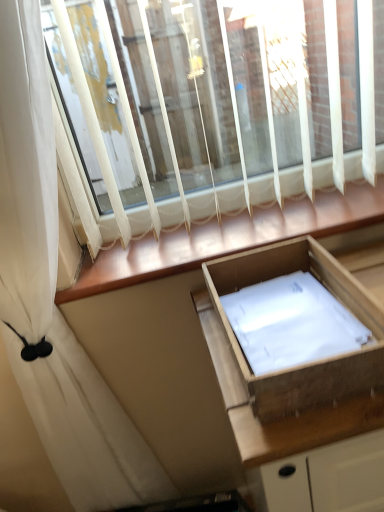
Question: Is white sheer curtain at upper left in contact with wooden at lower center?

Choices:
 (A) no
 (B) yes

Answer: (A)

Question: Can you confirm if white sheer curtain at upper left is positioned to the left of wooden at lower center?

Choices:
 (A) no
 (B) yes

Answer: (B)

Question: Is white sheer curtain at upper left thinner than wooden at lower center?

Choices:
 (A) yes
 (B) no

Answer: (A)

Question: Is wooden at lower center a part of white sheer curtain at upper left?

Choices:
 (A) yes
 (B) no

Answer: (B)

Question: Considering the relative sizes of white sheer curtain at upper left and wooden at lower center in the image provided, is white sheer curtain at upper left shorter than wooden at lower center?

Choices:
 (A) no
 (B) yes

Answer: (A)

Question: From the image's perspective, relative to wooden drawer at center, is white sheer curtain at upper left above or below?

Choices:
 (A) below
 (B) above

Answer: (B)

Question: Considering the positions of point (51, 221) and point (210, 292), is point (51, 221) closer or farther from the camera than point (210, 292)?

Choices:
 (A) farther
 (B) closer

Answer: (B)

Question: Is white sheer curtain at upper left in front of or behind wooden drawer at center in the image?

Choices:
 (A) behind
 (B) front

Answer: (B)

Question: From their relative heights in the image, would you say white sheer curtain at upper left is taller or shorter than wooden drawer at center?

Choices:
 (A) tall
 (B) short

Answer: (A)

Question: Considering the relative positions of white sheer curtain at upper left and wooden at lower center in the image provided, is white sheer curtain at upper left to the left or to the right of wooden at lower center?

Choices:
 (A) left
 (B) right

Answer: (A)

Question: Is white sheer curtain at upper left in front of or behind wooden at lower center in the image?

Choices:
 (A) behind
 (B) front

Answer: (B)

Question: Considering the positions of white sheer curtain at upper left and wooden at lower center in the image, is white sheer curtain at upper left wider or thinner than wooden at lower center?

Choices:
 (A) thin
 (B) wide

Answer: (A)

Question: Based on their sizes in the image, would you say white sheer curtain at upper left is bigger or smaller than wooden at lower center?

Choices:
 (A) small
 (B) big

Answer: (B)

Question: Is point (312, 409) positioned closer to the camera than point (23, 244)?

Choices:
 (A) farther
 (B) closer

Answer: (B)

Question: Considering their positions, is wooden drawer at center located in front of or behind white sheer curtain at upper left?

Choices:
 (A) behind
 (B) front

Answer: (A)